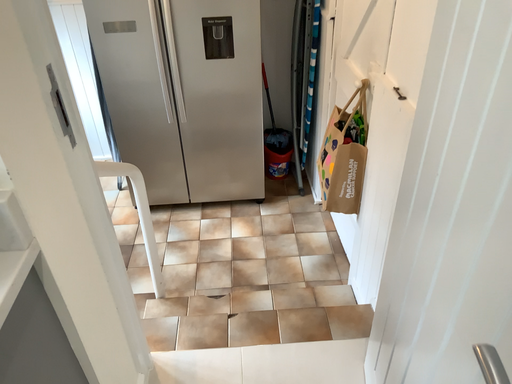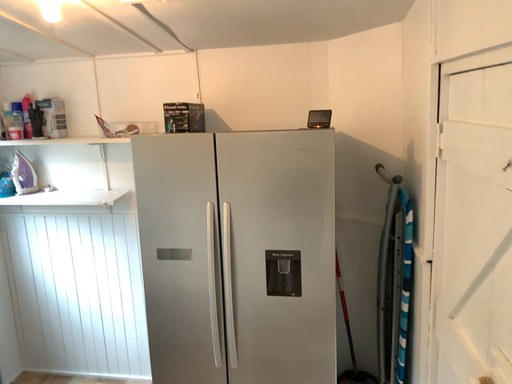
Question: Which way did the camera rotate in the video?

Choices:
 (A) rotated left
 (B) rotated right

Answer: (A)